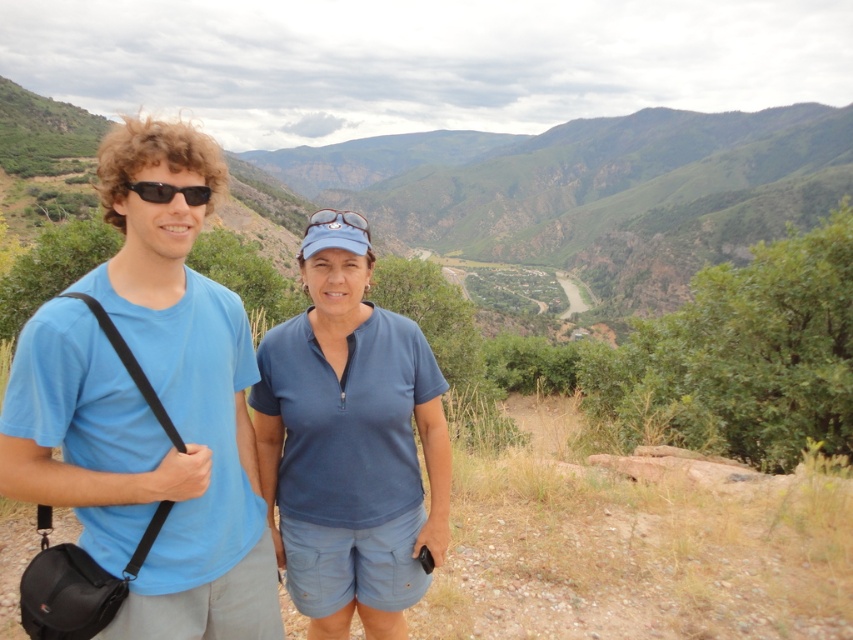
Question: Can you confirm if blue cotton t-shirt at left is positioned above blue matte sunglasses at center?

Choices:
 (A) no
 (B) yes

Answer: (A)

Question: Which point is farther from the camera taking this photo?

Choices:
 (A) (331, 211)
 (B) (163, 170)
 (C) (200, 200)

Answer: (A)

Question: Which point is closer to the camera?

Choices:
 (A) (167, 200)
 (B) (206, 540)
 (C) (352, 225)
 (D) (398, 483)

Answer: (A)

Question: Which object is the farthest from the blue cotton shirt at center?

Choices:
 (A) blue matte sunglasses at center
 (B) blue cotton t-shirt at left

Answer: (A)

Question: Can you confirm if sunglasses at left is positioned to the right of blue matte sunglasses at center?

Choices:
 (A) yes
 (B) no

Answer: (A)

Question: Can you confirm if blue cotton t-shirt at left is thinner than blue cotton shirt at center?

Choices:
 (A) yes
 (B) no

Answer: (B)